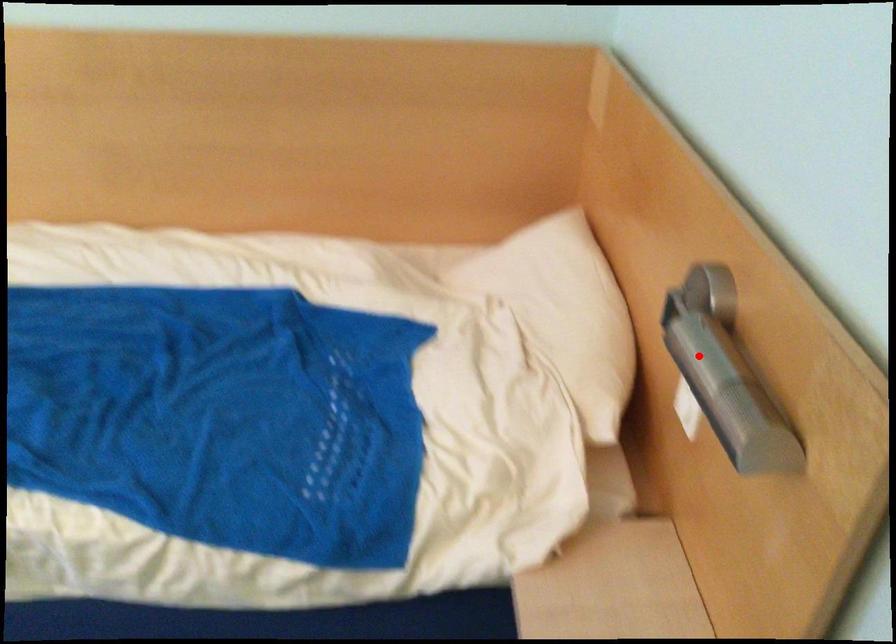
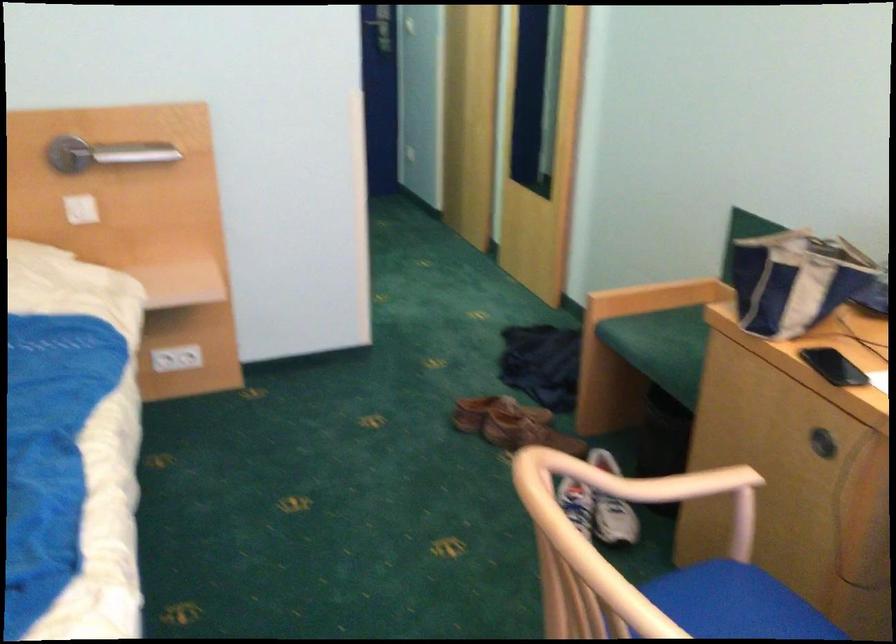
Question: I am providing you with two images of the same scene from different viewpoints. A red point is shown in image1. For the corresponding object point in image2, is it positioned nearer or farther from the camera?

Choices:
 (A) Nearer
 (B) Farther

Answer: (B)